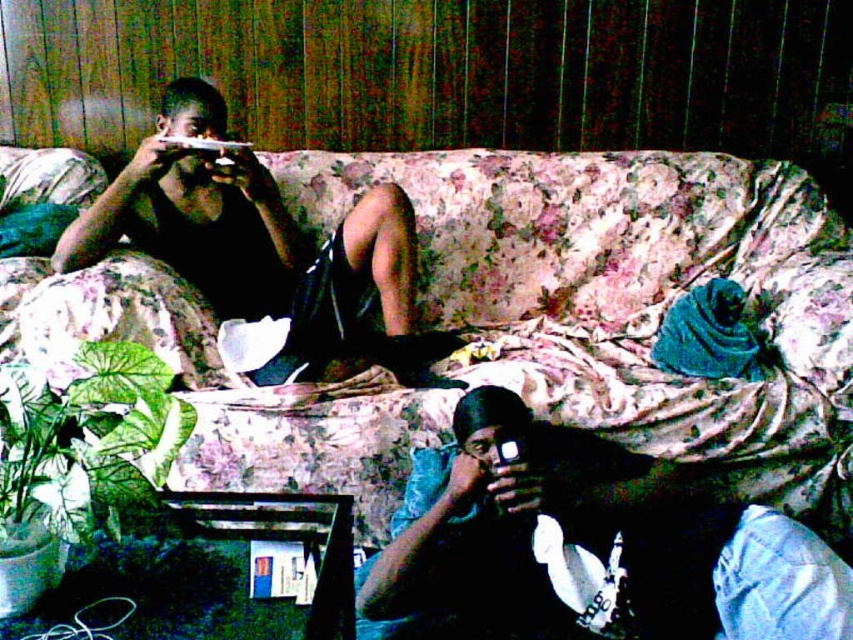
The width and height of the screenshot is (853, 640). What do you see at coordinates (584, 547) in the screenshot? I see `matte black phone at center` at bounding box center [584, 547].

Who is lower down, matte black phone at center or matte black phone at upper left?

matte black phone at center

Who is more forward, (637,472) or (381,220)?

Positioned in front is point (637,472).

At what (x,y) coordinates should I click in order to perform the action: click on matte black phone at center. Please return your answer as a coordinate pair (x, y). The height and width of the screenshot is (640, 853). Looking at the image, I should click on (584, 547).